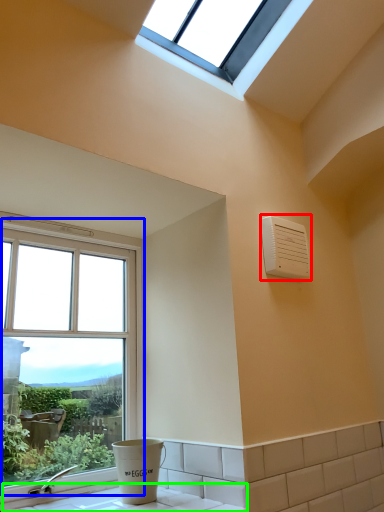
Question: Estimate the real-world distances between objects in this image. Which object is farther from air conditioning (highlighted by a red box), window (highlighted by a blue box) or counter top (highlighted by a green box)?

Choices:
 (A) window
 (B) counter top

Answer: (B)